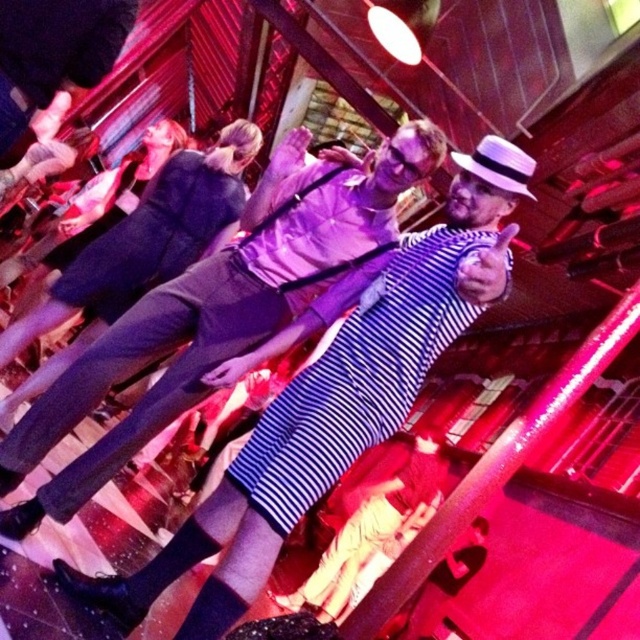
You are a photographer trying to capture the two dancers in the nightclub scene. You notice two points of interest marked as point 1 at coordinates point [317,397] and point 2 at coordinates point [378,486]. Since you want to focus on the dancer closer to the front, which point should you prioritize in your composition?

Point 1 at coordinates point [317,397] is closer to the camera than point 2 at coordinates point [378,486], so you should prioritize point 1 for focusing on the dancer closer to the front.

Based on the photo, you are a photographer at the nightclub and want to ensure both the striped fabric shirt at center and the matte black dress at center are clearly visible in your photo. Given their sizes, which one might you need to adjust your camera focus on to capture more detail?

The striped fabric shirt at center is larger in size than the matte black dress at center, so you should focus on the striped fabric shirt at center to capture more detail.

Looking at this image, you are a photographer at the nightclub and want to capture both the matte black dress at center and the striped fabric dress at center in a single frame. Since the camera can only focus on the larger object, which dress should you aim for to ensure both are visible?

The striped fabric dress at center is larger than the matte black dress at center, so you should aim for the striped fabric dress at center to ensure both are visible in the frame.